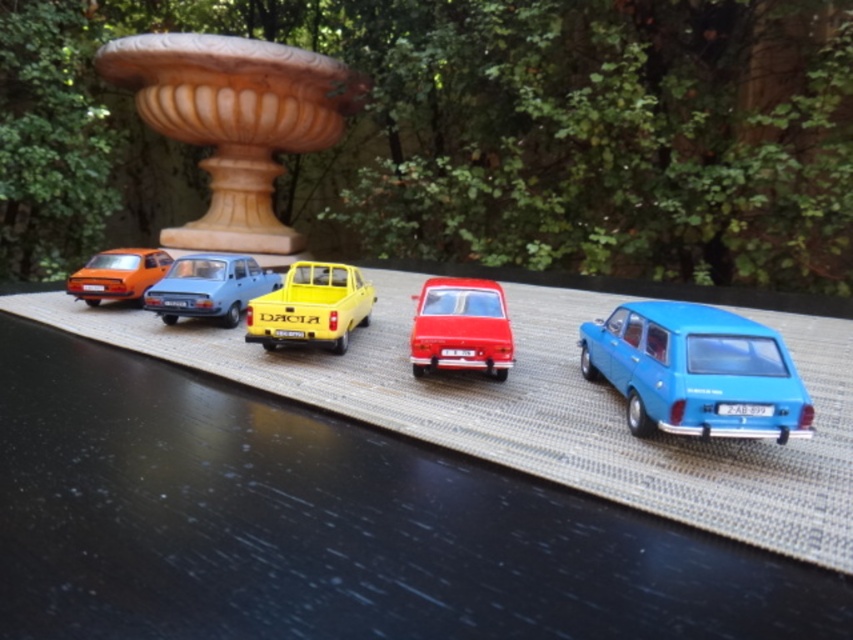
You are a child playing with toy cars on a cobblestone surface. You have a glossy red sedan at center and a matte orange car at left. Which car is closer to the ornate fountain behind them?

The glossy red sedan at center is closer to the ornate fountain behind them because it is positioned on the right side of the matte orange car at left, meaning it is further away from the fountain compared to the matte orange car at left. Wait, no, that contradicts. Let me think again. The fountain is behind the cars. If the red sedan is to the right of the orange car, their positions relative to the fountain depend on their arrangement. Since they are arranged in a row, the cars are in a straight line. If

You are a toy collector examining the miniature scene. You notice the matte blue sedan at center and the matte orange car at left. Which car is positioned lower in the arrangement?

The matte blue sedan at center is positioned lower than the matte orange car at left according to the description.